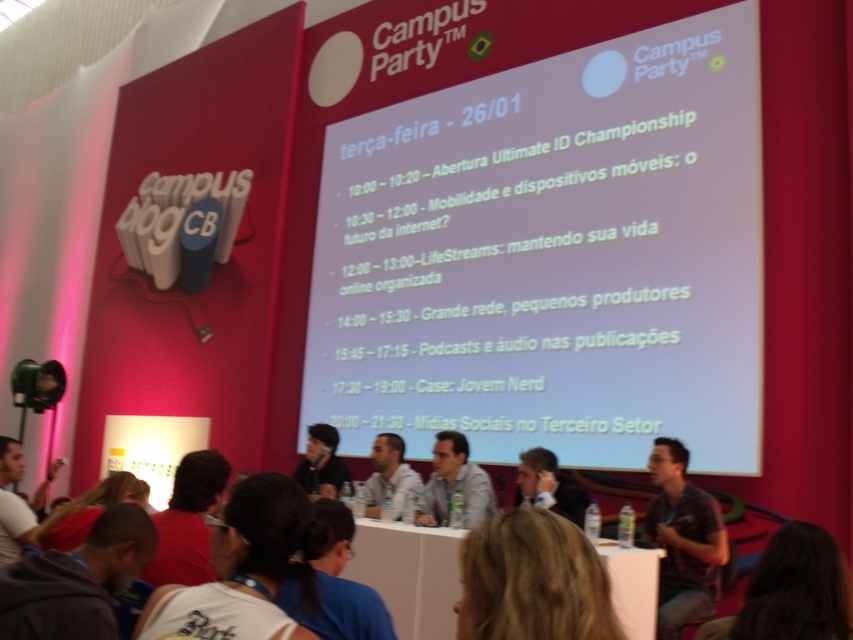
Question: Is dark gray hoodie at lower left positioned behind striped denim shirt at right?

Choices:
 (A) no
 (B) yes

Answer: (A)

Question: Considering the real-world distances, which object is farthest from the white paper at center?

Choices:
 (A) gray fabric shirt at center
 (B) black hair at lower center
 (C) striped denim shirt at right
 (D) light gray shirt at center

Answer: (B)

Question: Which object is farther from the camera taking this photo?

Choices:
 (A) dark gray hoodie at lower left
 (B) blonde hair at center

Answer: (A)

Question: Can you confirm if dark gray hoodie at lower left is positioned below black hair at lower center?

Choices:
 (A) yes
 (B) no

Answer: (B)

Question: Does white paper at center have a larger size compared to black matte shirt at center?

Choices:
 (A) no
 (B) yes

Answer: (A)

Question: Which of the following is the farthest from the observer?

Choices:
 (A) dark brown hair at lower left
 (B) light gray shirt at center
 (C) brown leather jacket at lower center
 (D) gray fabric shirt at center

Answer: (B)